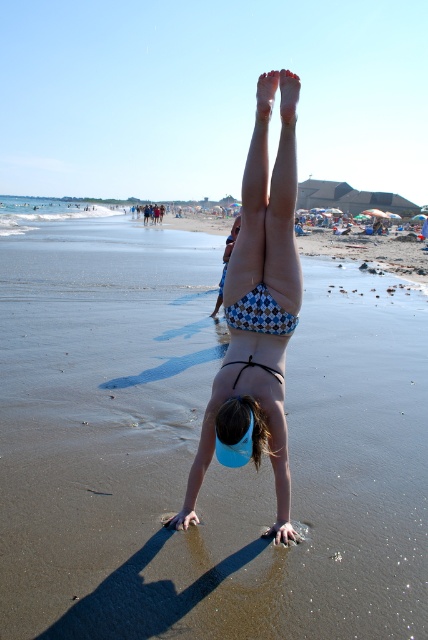
Question: Which point is farther to the camera?

Choices:
 (A) clear blue water at lower left
 (B) blue checkered bikini top at center

Answer: (A)

Question: Can you confirm if brown sandy beach at center is thinner than clear blue water at lower left?

Choices:
 (A) no
 (B) yes

Answer: (B)

Question: Which point is farther to the camera?

Choices:
 (A) (175, 438)
 (B) (17, 205)

Answer: (B)

Question: Which point is closer to the camera taking this photo?

Choices:
 (A) (406, 540)
 (B) (11, 216)
 (C) (207, 404)

Answer: (A)

Question: Is brown sandy beach at center positioned before clear blue water at lower left?

Choices:
 (A) yes
 (B) no

Answer: (A)

Question: Is brown sandy beach at center positioned behind clear blue water at lower left?

Choices:
 (A) yes
 (B) no

Answer: (B)